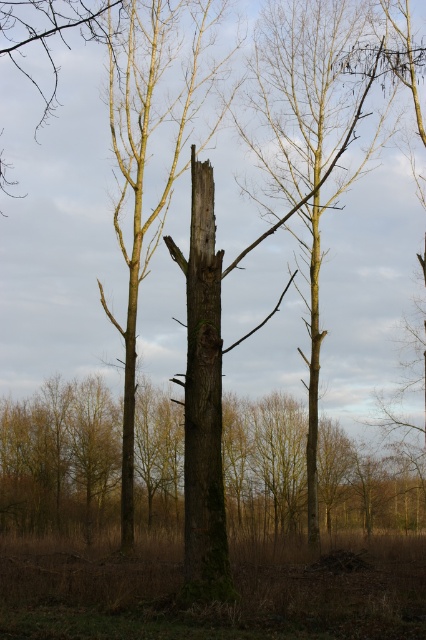
You are a botanist examining two trees in the center of the forest scene. You notice a smooth bark tree at center and a green mossy bark at center. Which of these two trees is located to the right of the other?

The smooth bark tree at center is positioned on the right side of green mossy bark at center, so the smooth bark tree at center is to the right of the green mossy bark at center.